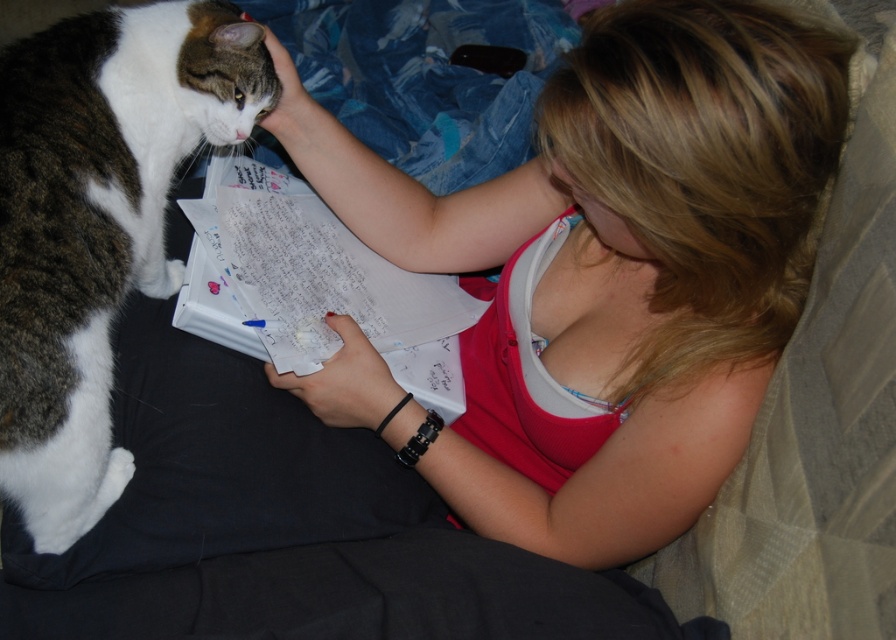
Question: Can you confirm if matte pink tank top at center is positioned to the right of tabby fur cat at left?

Choices:
 (A) yes
 (B) no

Answer: (A)

Question: Among these points, which one is farthest from the camera?

Choices:
 (A) (699, 483)
 (B) (65, 67)

Answer: (B)

Question: Can you confirm if matte pink tank top at center is positioned to the left of tabby fur cat at left?

Choices:
 (A) yes
 (B) no

Answer: (B)

Question: Is matte pink tank top at center further to the viewer compared to tabby fur cat at left?

Choices:
 (A) no
 (B) yes

Answer: (A)